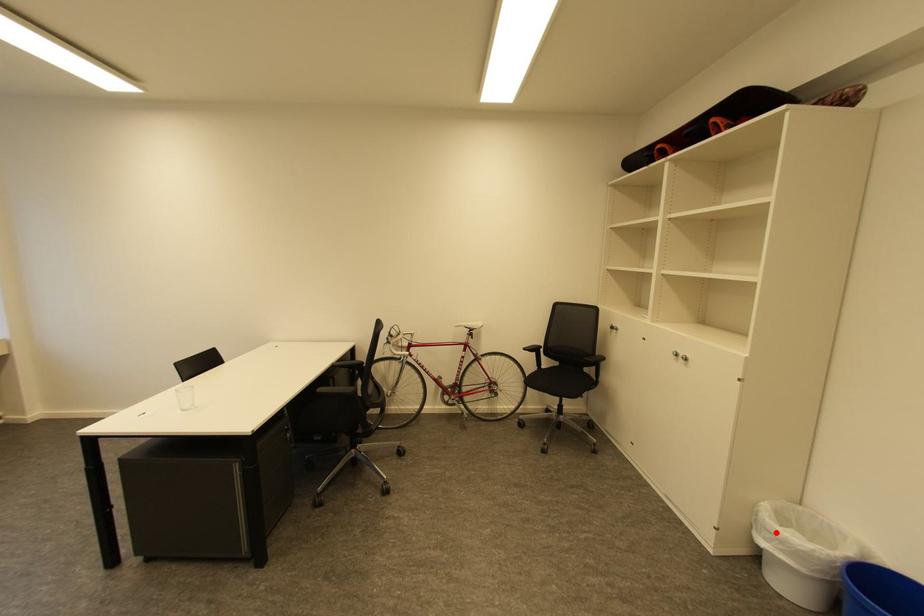
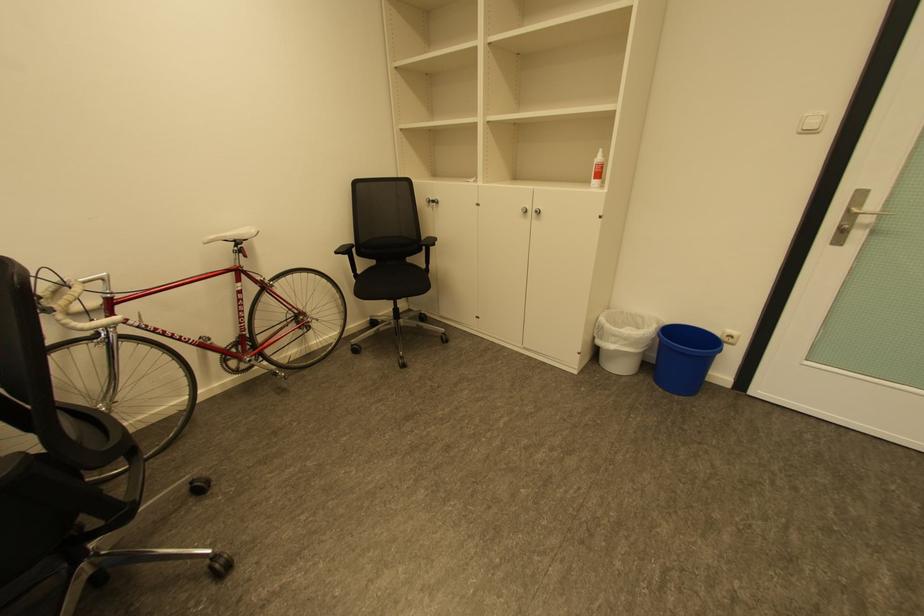
Question: A red point is marked in image1. In image2, is the corresponding 3D point closer to the camera or farther? Reply with the corresponding letter.

Choices:
 (A) The corresponding 3D point is closer.
 (B) The corresponding 3D point is farther.

Answer: (A)